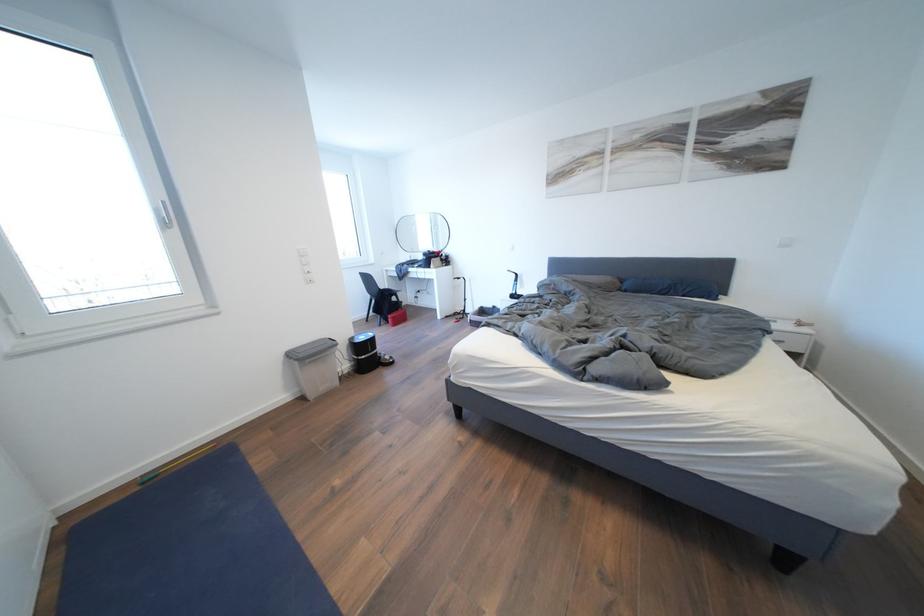
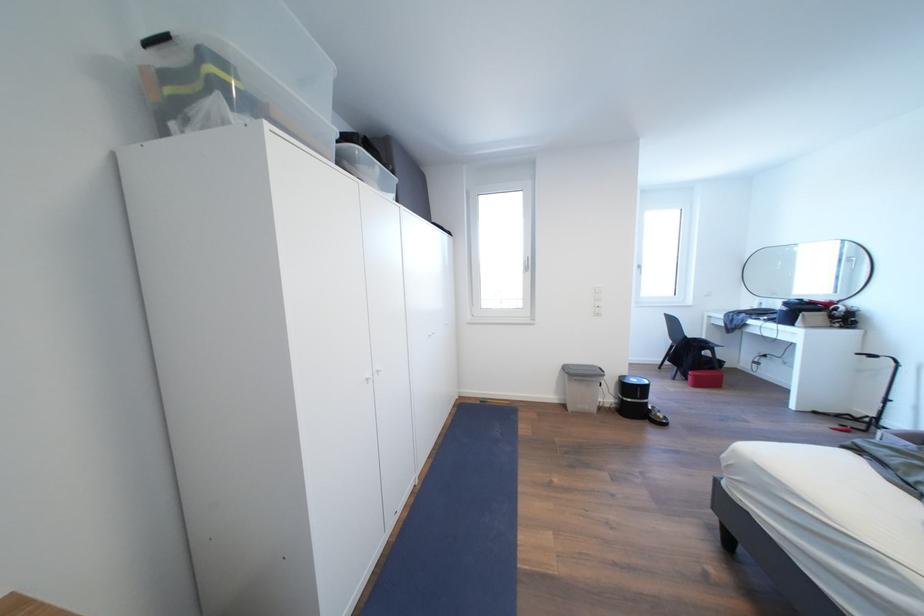
Where in the second image is the point corresponding to point 400,323 from the first image?

(703, 381)